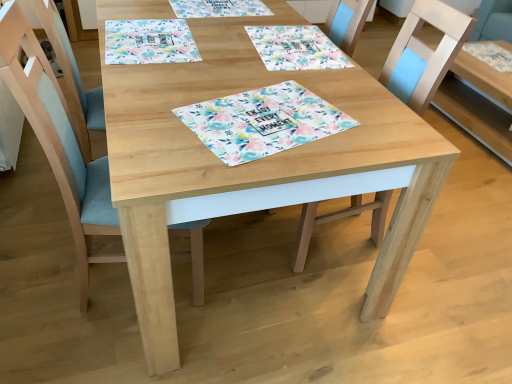
Describe the element at coordinates (479, 103) in the screenshot. I see `natural wood table at right, acting as the second table starting from the left` at that location.

Where is `natural wood table at right, which is counted as the first table, starting from the right`? natural wood table at right, which is counted as the first table, starting from the right is located at coordinates (479, 103).

What is the approximate width of floral fabric placemat at upper center?

floral fabric placemat at upper center is 18.21 inches wide.

The height and width of the screenshot is (384, 512). What are the coordinates of `wooden chair at center, acting as the 2th chair starting from the left` in the screenshot? It's located at (424, 53).

The height and width of the screenshot is (384, 512). Find the location of `floral paper placemat at center`. floral paper placemat at center is located at coordinates (262, 122).

Which object is wider, natural wood table at right, acting as the second table starting from the left, or light blue fabric chair at left, acting as the 1th chair starting from the left?

natural wood table at right, acting as the second table starting from the left, is wider.

Does point (502, 127) lie behind point (79, 264)?

Yes.

Is natural wood table at right, which is counted as the first table, starting from the right, positioned far away from light blue fabric chair at left, acting as the 1th chair starting from the left?

Yes, natural wood table at right, which is counted as the first table, starting from the right, and light blue fabric chair at left, acting as the 1th chair starting from the left, are located far from each other.

Between wooden chair at center, which appears as the 1th chair when viewed from the right, and natural wood table at right, which is counted as the first table, starting from the right, which one appears on the right side from the viewer's perspective?

natural wood table at right, which is counted as the first table, starting from the right, is more to the right.

Which of these two, wooden chair at center, which appears as the 1th chair when viewed from the right, or natural wood table at right, acting as the second table starting from the left, stands taller?

wooden chair at center, which appears as the 1th chair when viewed from the right.

Is point (405, 24) closer to viewer compared to point (472, 108)?

Yes, point (405, 24) is in front of point (472, 108).

How many degrees apart are the facing directions of wooden chair at center, which appears as the 1th chair when viewed from the right, and natural wood table at right, which is counted as the first table, starting from the right?

The angle between the facing direction of wooden chair at center, which appears as the 1th chair when viewed from the right, and the facing direction of natural wood table at right, which is counted as the first table, starting from the right, is 1.36 degrees.

Can you confirm if natural wood table at right, acting as the second table starting from the left, is bigger than floral paper placemat at center?

Correct, natural wood table at right, acting as the second table starting from the left, is larger in size than floral paper placemat at center.

Do you think natural wood table at right, which is counted as the first table, starting from the right, is within floral paper placemat at center, or outside of it?

natural wood table at right, which is counted as the first table, starting from the right, cannot be found inside floral paper placemat at center.

Is point (503, 99) farther from viewer compared to point (260, 99)?

Yes, point (503, 99) is farther from viewer.

Could you tell me if natural wood table at right, which is counted as the first table, starting from the right, is facing floral paper placemat at center?

No, natural wood table at right, which is counted as the first table, starting from the right, is not turned towards floral paper placemat at center.

Is wooden chair at center, acting as the 2th chair starting from the left, far away from light blue fabric chair at left, marked as the 2th chair in a right-to-left arrangement?

wooden chair at center, acting as the 2th chair starting from the left, is far away from light blue fabric chair at left, marked as the 2th chair in a right-to-left arrangement.

Which of these two, wooden chair at center, acting as the 2th chair starting from the left, or light blue fabric chair at left, acting as the 1th chair starting from the left, stands taller?

light blue fabric chair at left, acting as the 1th chair starting from the left, is taller.

Is wooden chair at center, which appears as the 1th chair when viewed from the right, at the right side of light blue fabric chair at left, marked as the 2th chair in a right-to-left arrangement?

Correct, you'll find wooden chair at center, which appears as the 1th chair when viewed from the right, to the right of light blue fabric chair at left, marked as the 2th chair in a right-to-left arrangement.

Find the location of a particular element. The width and height of the screenshot is (512, 384). chair located underneath the light blue fabric chair at left, acting as the 1th chair starting from the left (from a real-world perspective) is located at coordinates [x=424, y=53].

Looking at this image, is floral fabric placemat at upper center a part of light blue fabric chair at left, marked as the 2th chair in a right-to-left arrangement?

No, floral fabric placemat at upper center is located outside of light blue fabric chair at left, marked as the 2th chair in a right-to-left arrangement.

Which is behind, point (85, 251) or point (245, 27)?

The point (245, 27) is more distant.

From their relative heights in the image, would you say light blue fabric chair at left, acting as the 1th chair starting from the left, is taller or shorter than floral fabric placemat at upper center?

Clearly, light blue fabric chair at left, acting as the 1th chair starting from the left, is taller compared to floral fabric placemat at upper center.

Which is more to the left, light blue fabric chair at left, marked as the 2th chair in a right-to-left arrangement, or floral fabric placemat at upper center?

Positioned to the left is light blue fabric chair at left, marked as the 2th chair in a right-to-left arrangement.

From a real-world perspective, who is located lower, wooden chair at center, which appears as the 1th chair when viewed from the right, or natural wood table at center, which is the second table in right-to-left order?

In real-world perspective, natural wood table at center, which is the second table in right-to-left order, is lower.

Would you say natural wood table at center, which appears as the first table when viewed from the left, is part of wooden chair at center, which appears as the 1th chair when viewed from the right,'s contents?

No, natural wood table at center, which appears as the first table when viewed from the left, is not a part of wooden chair at center, which appears as the 1th chair when viewed from the right.

The width and height of the screenshot is (512, 384). In order to click on the 1st chair directly above the natural wood table at center, which appears as the first table when viewed from the left (from a real-world perspective) in this screenshot , I will do `click(424, 53)`.

Is wooden chair at center, which appears as the 1th chair when viewed from the right, positioned before natural wood table at center, which appears as the first table when viewed from the left?

No, it is not.

Can you confirm if light blue fabric chair at left, acting as the 1th chair starting from the left, is positioned to the right of natural wood table at center, which is the second table in right-to-left order?

No, light blue fabric chair at left, acting as the 1th chair starting from the left, is not to the right of natural wood table at center, which is the second table in right-to-left order.

Is light blue fabric chair at left, marked as the 2th chair in a right-to-left arrangement, outside of natural wood table at center, which is the second table in right-to-left order?

No, light blue fabric chair at left, marked as the 2th chair in a right-to-left arrangement, is inside or overlapping with natural wood table at center, which is the second table in right-to-left order.

From a real-world perspective, which is physically above, light blue fabric chair at left, acting as the 1th chair starting from the left, or natural wood table at center, which appears as the first table when viewed from the left?

light blue fabric chair at left, acting as the 1th chair starting from the left, from a real-world perspective.

Is point (195, 253) closer or farther from the camera than point (394, 112)?

Point (195, 253) is positioned farther from the camera compared to point (394, 112).

You are a GUI agent. You are given a task and a screenshot of the screen. Output one action in this format:
    pyautogui.click(x=<x>, y=<y>)
    Task: Click on the 2nd table behind when counting from the light blue fabric chair at left, acting as the 1th chair starting from the left
    This screenshot has width=512, height=384.
    Given the screenshot: What is the action you would take?
    pyautogui.click(x=479, y=103)

Which chair is the 1st one when counting from the front of the natural wood table at right, acting as the second table starting from the left? Please provide its 2D coordinates.

[(424, 53)]

When comparing their distances from natural wood table at center, which is the second table in right-to-left order, does floral paper placemat at center or natural wood table at right, which is counted as the first table, starting from the right, seem further?

Among the two, natural wood table at right, which is counted as the first table, starting from the right, is located further to natural wood table at center, which is the second table in right-to-left order.

Consider the image. Estimate the real-world distances between objects in this image. Which object is closer to natural wood table at right, acting as the second table starting from the left, wooden chair at center, which appears as the 1th chair when viewed from the right, or light blue fabric chair at left, marked as the 2th chair in a right-to-left arrangement?

Based on the image, wooden chair at center, which appears as the 1th chair when viewed from the right, appears to be nearer to natural wood table at right, acting as the second table starting from the left.

Which object lies nearer to the anchor point wooden chair at center, acting as the 2th chair starting from the left, floral fabric placemat at upper center or light blue fabric chair at left, marked as the 2th chair in a right-to-left arrangement?

floral fabric placemat at upper center.

From the image, which object appears to be nearer to light blue fabric chair at left, marked as the 2th chair in a right-to-left arrangement, floral paper placemat at center or floral fabric placemat at upper center?

floral paper placemat at center lies closer to light blue fabric chair at left, marked as the 2th chair in a right-to-left arrangement, than the other object.

From the image, which object appears to be farther from floral fabric placemat at upper center, wooden chair at center, which appears as the 1th chair when viewed from the right, or light blue fabric chair at left, acting as the 1th chair starting from the left?

light blue fabric chair at left, acting as the 1th chair starting from the left.

When comparing their distances from floral fabric placemat at upper center, does natural wood table at right, acting as the second table starting from the left, or wooden chair at center, which appears as the 1th chair when viewed from the right, seem closer?

wooden chair at center, which appears as the 1th chair when viewed from the right.

Based on their spatial positions, is natural wood table at center, which is the second table in right-to-left order, or floral fabric placemat at upper center closer to floral paper placemat at center?

Among the two, natural wood table at center, which is the second table in right-to-left order, is located nearer to floral paper placemat at center.

Consider the image. Estimate the real-world distances between objects in this image. Which object is closer to floral paper placemat at center, natural wood table at center, which is the second table in right-to-left order, or wooden chair at center, which appears as the 1th chair when viewed from the right?

The object closer to floral paper placemat at center is natural wood table at center, which is the second table in right-to-left order.

Locate an element on the screen. The width and height of the screenshot is (512, 384). table between light blue fabric chair at left, acting as the 1th chair starting from the left, and floral fabric placemat at upper center in the front-back direction is located at coordinates click(250, 162).

The width and height of the screenshot is (512, 384). I want to click on chair between light blue fabric chair at left, marked as the 2th chair in a right-to-left arrangement, and natural wood table at right, which is counted as the first table, starting from the right, so click(424, 53).

This screenshot has height=384, width=512. In order to click on table between light blue fabric chair at left, acting as the 1th chair starting from the left, and natural wood table at right, which is counted as the first table, starting from the right, from left to right in this screenshot , I will do `click(250, 162)`.

You are a GUI agent. You are given a task and a screenshot of the screen. Output one action in this format:
    pyautogui.click(x=<x>, y=<y>)
    Task: Click on the place mat between light blue fabric chair at left, marked as the 2th chair in a right-to-left arrangement, and wooden chair at center, which appears as the 1th chair when viewed from the right, from left to right
    The width and height of the screenshot is (512, 384).
    Given the screenshot: What is the action you would take?
    pyautogui.click(x=262, y=122)